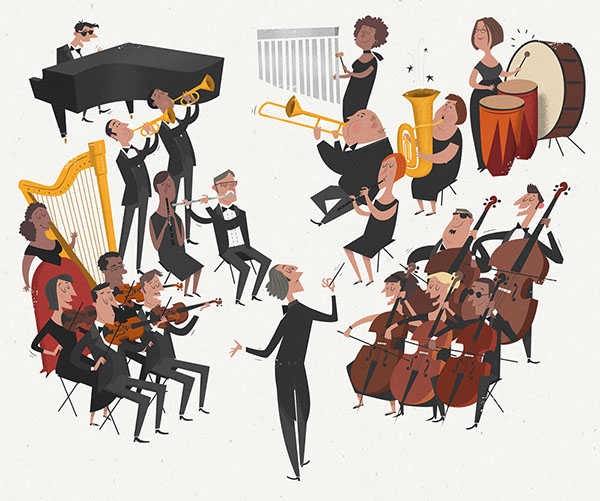
Locate an element on the screen. The image size is (600, 501). black piano is located at coordinates (61, 88), (97, 81), (162, 77), (173, 57), (116, 52).